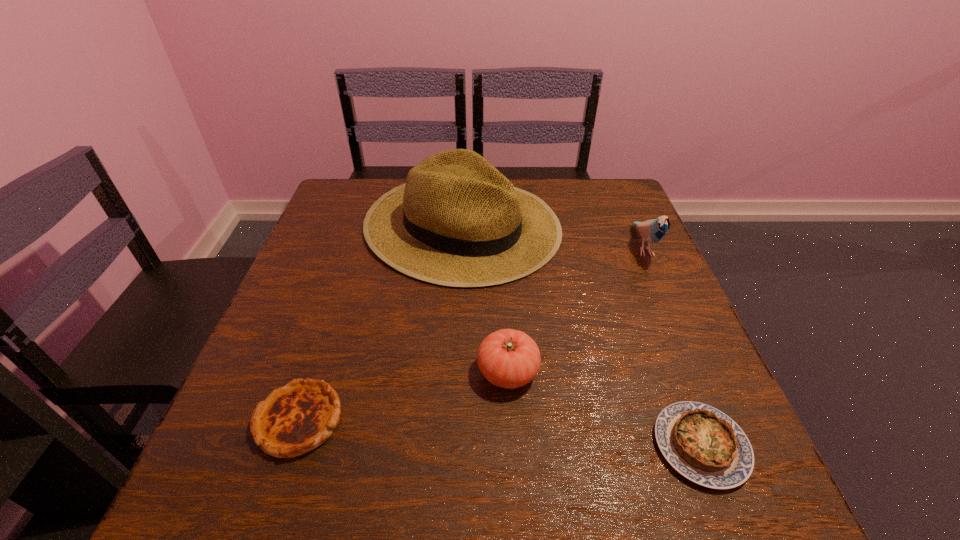
The height and width of the screenshot is (540, 960). Find the location of `sunhat present at the far edge`. sunhat present at the far edge is located at coordinates (457, 221).

Identify the location of bird that is at the far edge. The width and height of the screenshot is (960, 540). (652, 231).

Identify the location of sunhat located in the left edge section of the desktop. The image size is (960, 540). (457, 221).

At what (x,y) coordinates should I click in order to perform the action: click on quiche positioned at the left edge. Please return your answer as a coordinate pair (x, y). Looking at the image, I should click on (294, 419).

What are the coordinates of `bird positioned at the right edge` in the screenshot? It's located at (652, 231).

Image resolution: width=960 pixels, height=540 pixels. Identify the location of quiche at the right edge. point(703,444).

You are a GUI agent. You are given a task and a screenshot of the screen. Output one action in this format:
    pyautogui.click(x=<x>, y=<y>)
    Task: Click on the object present at the far left corner
    Image resolution: width=960 pixels, height=540 pixels.
    Given the screenshot: What is the action you would take?
    pyautogui.click(x=457, y=221)

Find the location of `object that is at the near left corner`. object that is at the near left corner is located at coordinates (294, 419).

Where is `object that is at the far right corner`? Image resolution: width=960 pixels, height=540 pixels. object that is at the far right corner is located at coordinates [652, 231].

Find the location of a particular element. The width and height of the screenshot is (960, 540). object present at the near right corner is located at coordinates (703, 444).